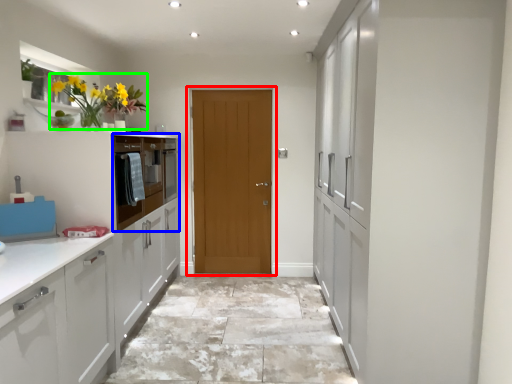
Question: Which object is the farthest from door (highlighted by a red box)? Choose among these: oven (highlighted by a blue box) or floral arrangement (highlighted by a green box).

Choices:
 (A) oven
 (B) floral arrangement

Answer: (B)